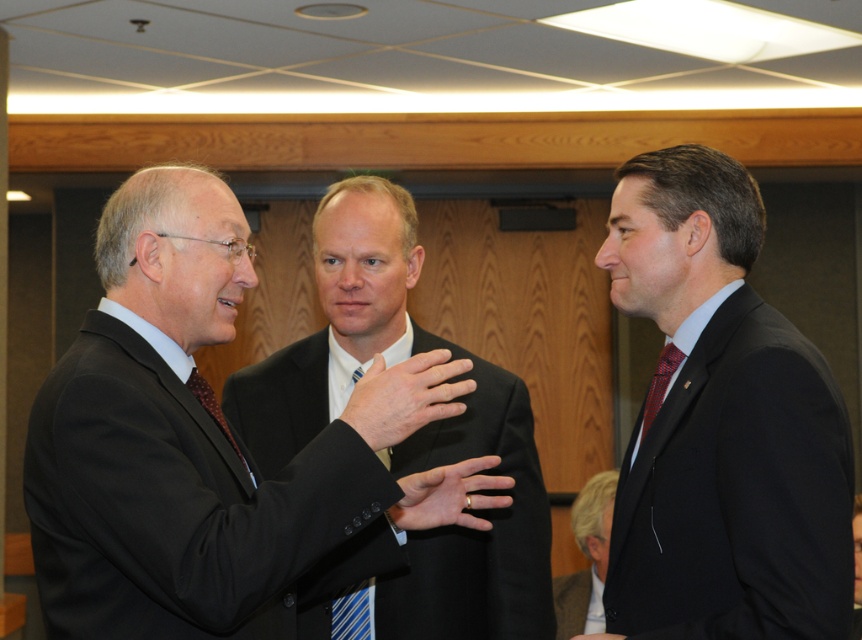
You are a photographer setting up for a group photo. You need to position the smooth black suit at center and the light brown leather jacket at lower right so that they are closer together than 3 meters. Based on the current scene, can you achieve this without moving any other objects?

The smooth black suit at center and light brown leather jacket at lower right are currently 2.87 meters apart, which is already under 3 meters. Therefore, no adjustment is needed as they are already within the desired distance.

You are a delivery robot with a height of 1.5 meters. You are positioned at point A, which is 1.68 meters away from the point labeled as point (413,417). Can you safely pass through this area without hitting your head?

The distance between you and point (413,417) is 1.68 meters. Since your height is 1.5 meters, which is less than the distance, you can safely pass through without hitting your head.